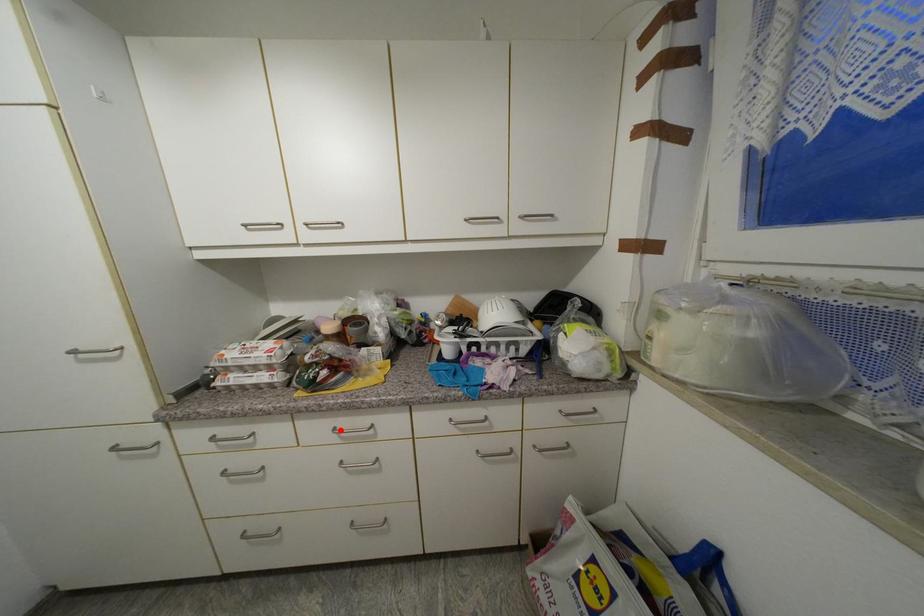
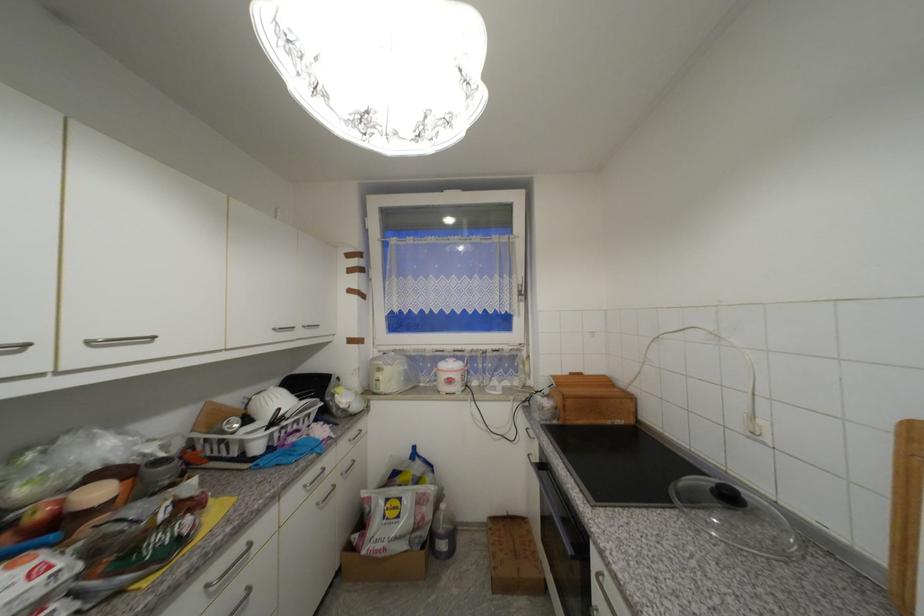
Question: I am providing you with two images of the same scene from different viewpoints. A red point is shown in image1. For the corresponding object point in image2, is it positioned nearer or farther from the camera?

Choices:
 (A) Nearer
 (B) Farther

Answer: (A)